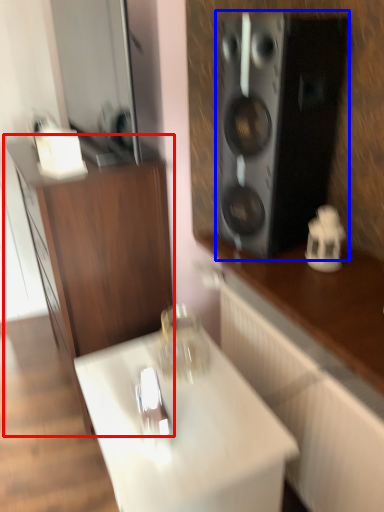
Question: Among these objects, which one is nearest to the camera, cabinetry (highlighted by a red box) or speaker (highlighted by a blue box)?

Choices:
 (A) cabinetry
 (B) speaker

Answer: (B)